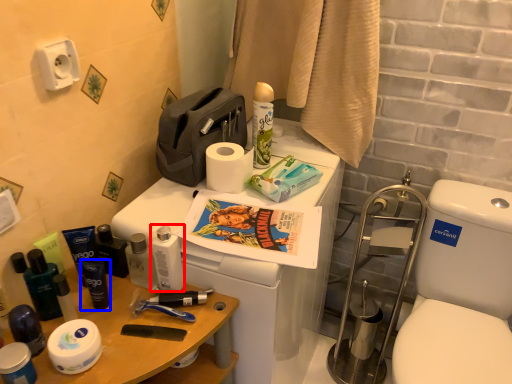
Question: Which object is closer to the camera taking this photo, toiletry (highlighted by a red box) or toiletry (highlighted by a blue box)?

Choices:
 (A) toiletry
 (B) toiletry

Answer: (A)